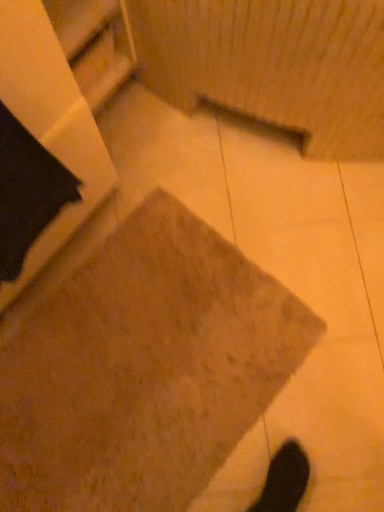
At what (x,y) coordinates should I click in order to perform the action: click on vacant area situated below brown textured concrete at center (from a real-world perspective). Please return your answer as a coordinate pair (x, y). The width and height of the screenshot is (384, 512). Looking at the image, I should click on (132, 367).